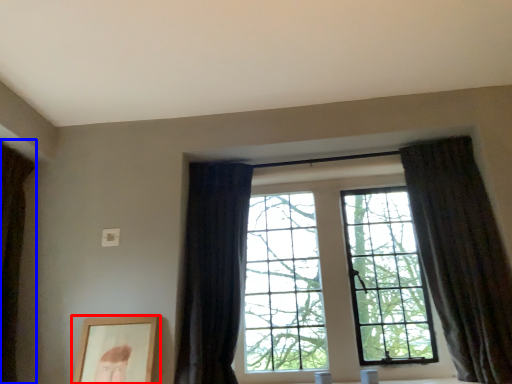
Question: Which object appears closest to the camera in this image, picture frame (highlighted by a red box) or curtain (highlighted by a blue box)?

Choices:
 (A) picture frame
 (B) curtain

Answer: (B)